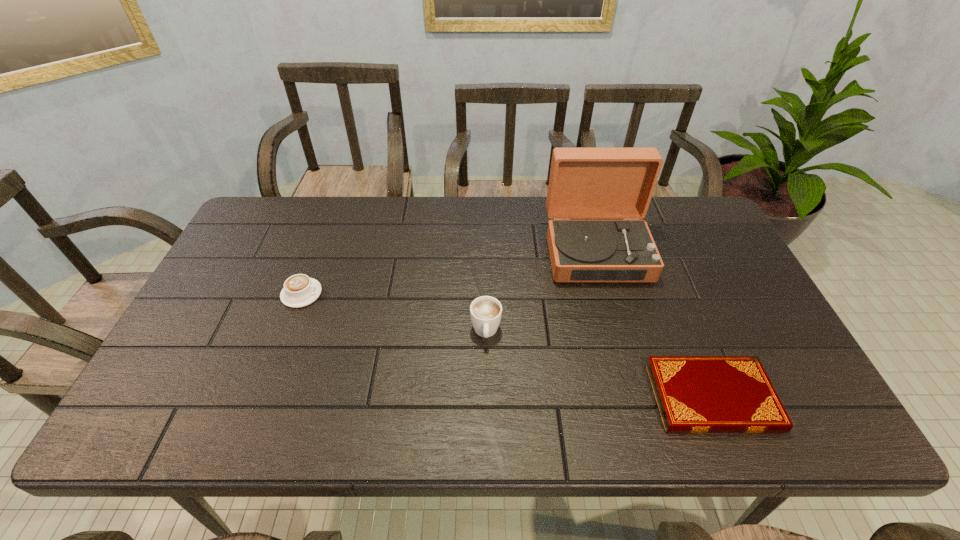
This screenshot has width=960, height=540. Identify the location of phonograph record. (585, 183).

Image resolution: width=960 pixels, height=540 pixels. What are the coordinates of `the third farthest object` in the screenshot? It's located at (485, 311).

The image size is (960, 540). In order to click on the third object from right to left in this screenshot , I will do `click(485, 311)`.

The height and width of the screenshot is (540, 960). I want to click on the second shortest object, so click(299, 290).

I want to click on the leftmost object, so click(x=299, y=290).

This screenshot has height=540, width=960. Find the location of `the nearest object`. the nearest object is located at coordinates (695, 394).

Locate an element on the screen. The image size is (960, 540). hardback book is located at coordinates click(695, 394).

The image size is (960, 540). Identify the location of free location located 0.320m on the face of the tallest object. (633, 386).

You are a GUI agent. You are given a task and a screenshot of the screen. Output one action in this format:
    pyautogui.click(x=<x>, y=<y>)
    Task: Click on the blank space located with the handle on the side of the second object from left to right
    The width and height of the screenshot is (960, 540).
    Given the screenshot: What is the action you would take?
    pyautogui.click(x=487, y=388)

Locate an element on the screen. Image resolution: width=960 pixels, height=540 pixels. blank area located with the handle on the right side of the farther cappuccino is located at coordinates (386, 294).